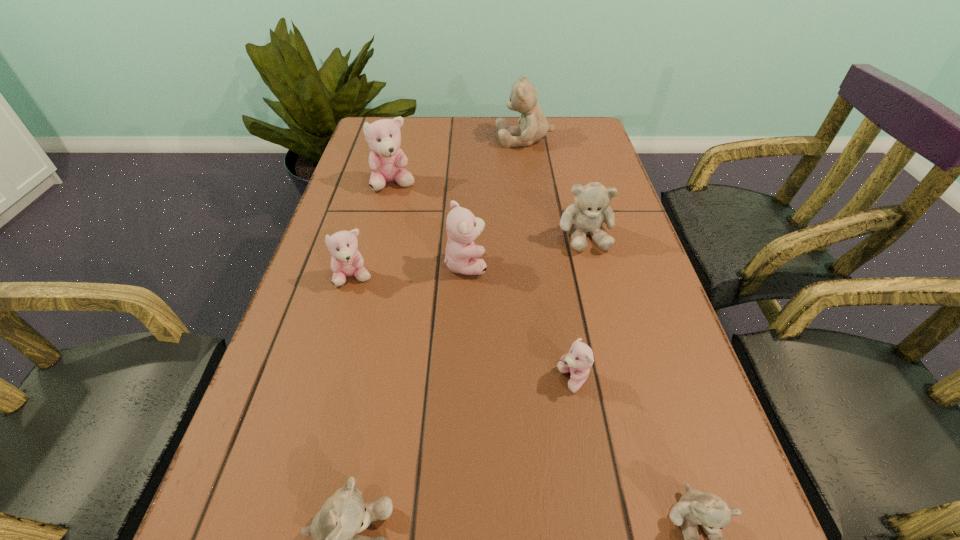
Where is `blank space that satisfies the following two spatial constraints: 1. on the face of the second biggest gray teddy bear; 2. at the face of the smallest pink teddy bear`? Image resolution: width=960 pixels, height=540 pixels. blank space that satisfies the following two spatial constraints: 1. on the face of the second biggest gray teddy bear; 2. at the face of the smallest pink teddy bear is located at coordinates (624, 380).